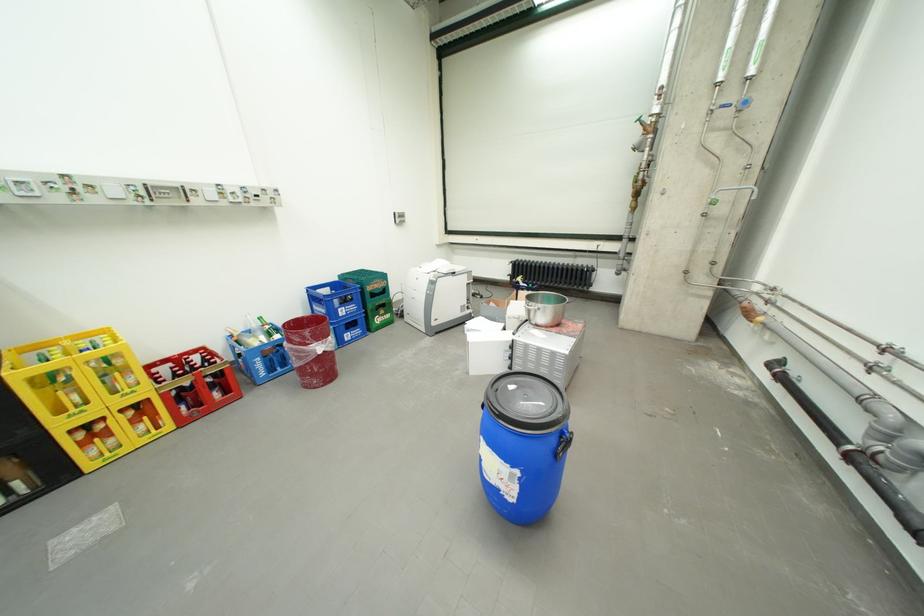
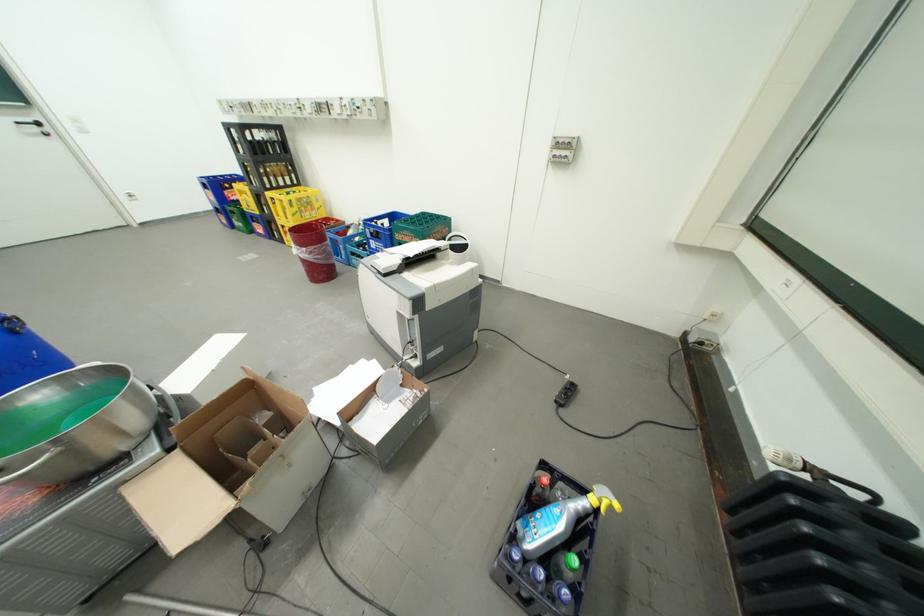
Find the pixel in the second image that matches point (393, 282) in the first image.

(424, 238)